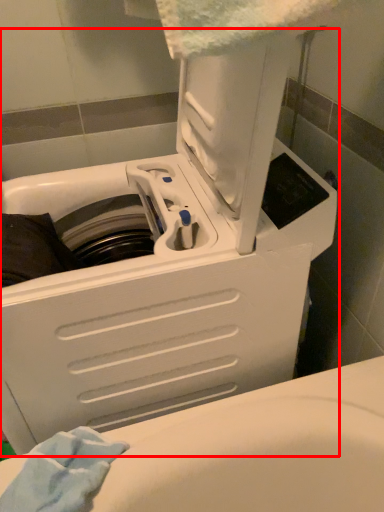
Question: Considering the relative positions of washing machine (annotated by the red box) and bath towel in the image provided, where is washing machine (annotated by the red box) located with respect to the staircase?

Choices:
 (A) left
 (B) right

Answer: (B)